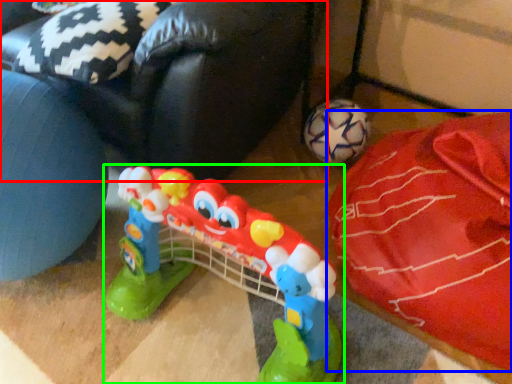
Question: Which object is positioned farthest from bean bag chair (highlighted by a red box)? Select from material (highlighted by a blue box) and toy (highlighted by a green box).

Choices:
 (A) material
 (B) toy

Answer: (A)